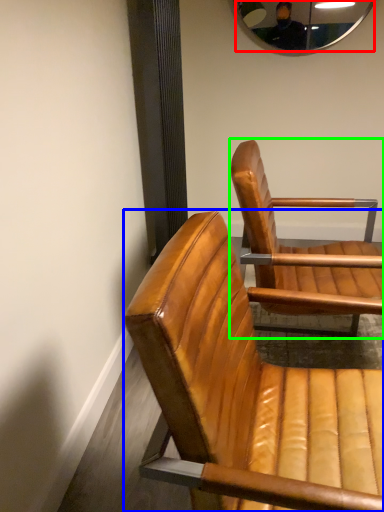
Question: Considering the real-world distances, which object is closest to mirror (highlighted by a red box)? chair (highlighted by a blue box) or chair (highlighted by a green box).

Choices:
 (A) chair
 (B) chair

Answer: (B)